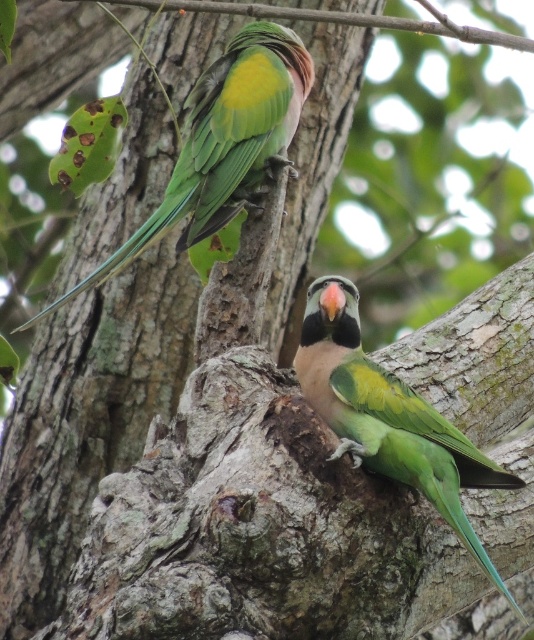
Question: Which object is farther from the camera taking this photo?

Choices:
 (A) green matte parrot at upper left
 (B) green matte parrot at center

Answer: (A)

Question: Can you confirm if green matte parrot at center is wider than green matte parrot at upper left?

Choices:
 (A) no
 (B) yes

Answer: (A)

Question: Which point is farther to the camera?

Choices:
 (A) (354, 401)
 (B) (234, 45)

Answer: (B)

Question: Does green matte parrot at center have a lesser width compared to green matte parrot at upper left?

Choices:
 (A) yes
 (B) no

Answer: (A)

Question: Does green matte parrot at center have a lesser width compared to green matte parrot at upper left?

Choices:
 (A) no
 (B) yes

Answer: (B)